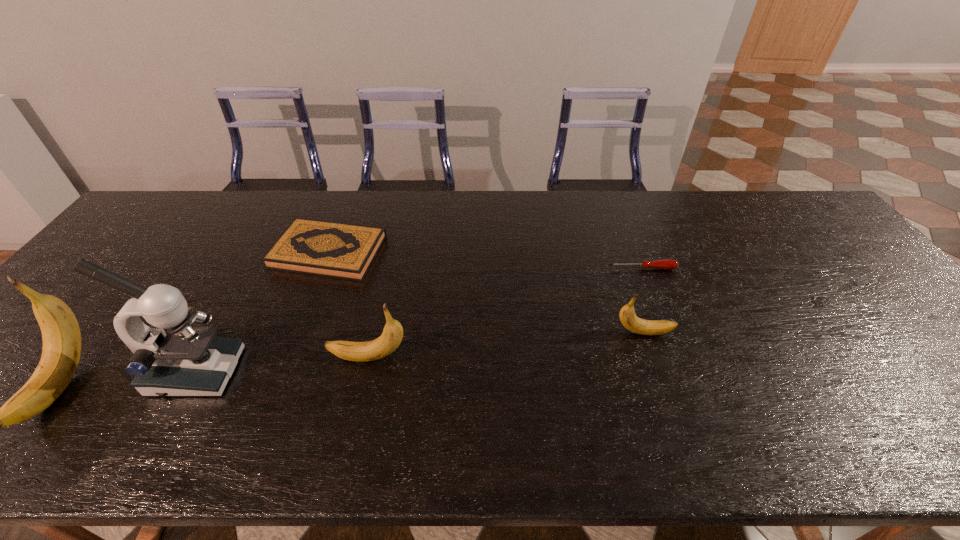
Locate an element on the screen. The image size is (960, 540). the leftmost banana is located at coordinates (61, 335).

You are a GUI agent. You are given a task and a screenshot of the screen. Output one action in this format:
    pyautogui.click(x=<x>, y=<y>)
    Task: Click on the second tallest object
    
    Given the screenshot: What is the action you would take?
    pyautogui.click(x=61, y=335)

The image size is (960, 540). Find the location of `the second banana from left to right`. the second banana from left to right is located at coordinates (392, 335).

This screenshot has width=960, height=540. In order to click on the second shortest banana in this screenshot , I will do `click(392, 335)`.

Image resolution: width=960 pixels, height=540 pixels. I want to click on the third shortest object, so click(x=628, y=318).

Identify the location of the third farthest object. The width and height of the screenshot is (960, 540). (628, 318).

Where is `hardback book`? The image size is (960, 540). hardback book is located at coordinates (338, 250).

Find the location of a particular element. This screenshot has height=540, width=960. screwdriver is located at coordinates (667, 264).

You are a GUI agent. You are given a task and a screenshot of the screen. Output one action in this format:
    pyautogui.click(x=<x>, y=<y>)
    Task: Click on the tallest object
    This screenshot has height=540, width=960.
    Given the screenshot: What is the action you would take?
    172,358

The height and width of the screenshot is (540, 960). In order to click on vacant point located 0.080m at the start of the peel on the third tallest object in this screenshot , I will do `click(295, 358)`.